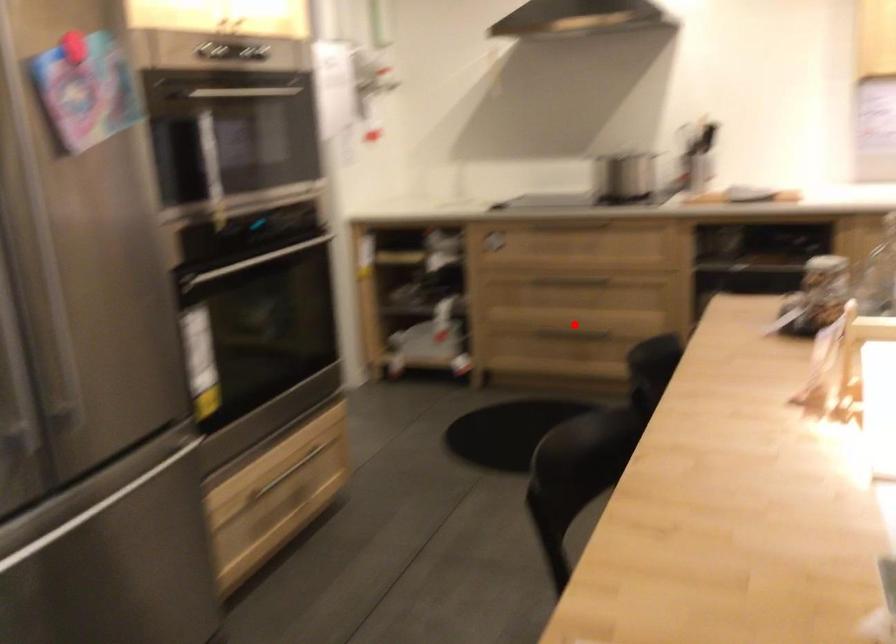
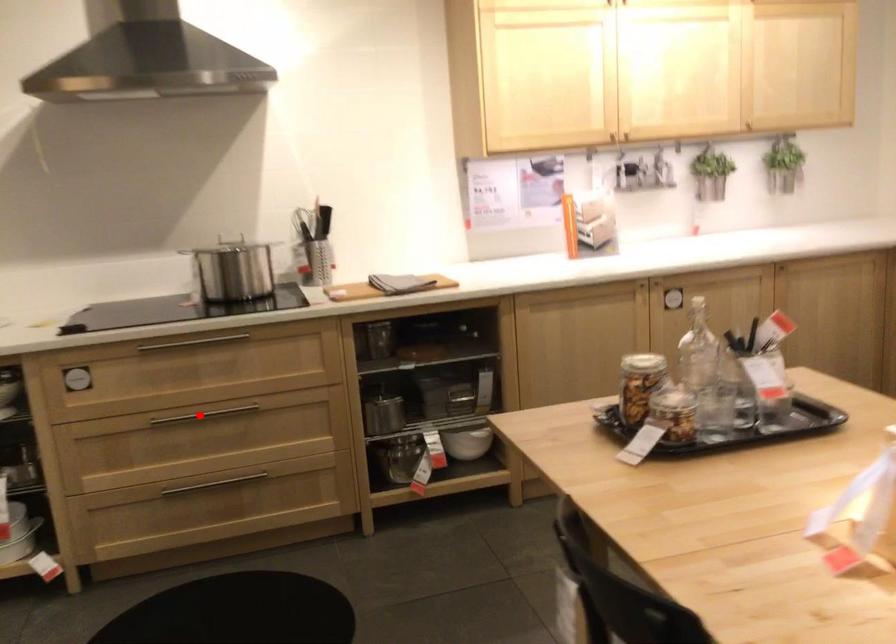
I am providing you with two images of the same scene from different viewpoints. A red point is marked on the first image and another point is marked on the second image. Does the point marked in image1 correspond to the same location as the one in image2?

No